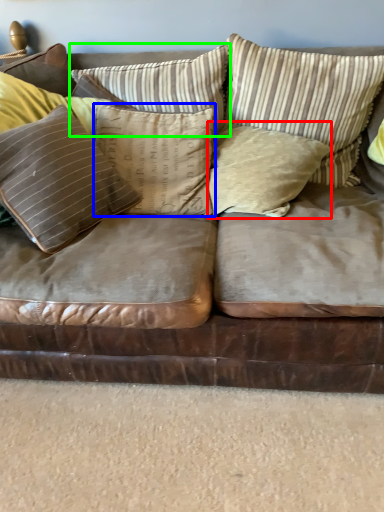
Question: Which object is positioned closest to pillow (highlighted by a red box)? Select from pillow (highlighted by a blue box) and pillow (highlighted by a green box).

Choices:
 (A) pillow
 (B) pillow

Answer: (A)